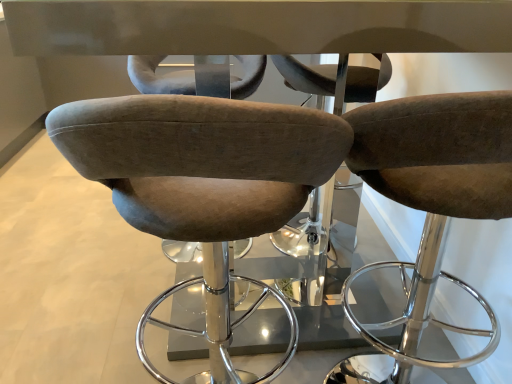
Question: Does point (403, 132) appear closer or farther from the camera than point (292, 175)?

Choices:
 (A) farther
 (B) closer

Answer: (A)

Question: From a real-world perspective, is suede-like brown stool at center, which appears as the 1th chair when viewed from the right, physically located above or below velvet brown stool at center, which is the 2th chair from right to left?

Choices:
 (A) below
 (B) above

Answer: (A)

Question: In terms of width, does suede-like brown stool at center, which appears as the 1th chair when viewed from the right, look wider or thinner when compared to velvet brown stool at center, the 1th chair in the left-to-right sequence?

Choices:
 (A) wide
 (B) thin

Answer: (A)

Question: From the image's perspective, relative to suede-like brown stool at center, which appears as the 1th chair when viewed from the right, is velvet brown stool at center, which is the 2th chair from right to left, above or below?

Choices:
 (A) below
 (B) above

Answer: (A)

Question: Considering the positions of velvet brown stool at center, the 1th chair in the left-to-right sequence, and suede-like brown stool at center, which appears as the 1th chair when viewed from the right, in the image, is velvet brown stool at center, the 1th chair in the left-to-right sequence, bigger or smaller than suede-like brown stool at center, which appears as the 1th chair when viewed from the right,?

Choices:
 (A) big
 (B) small

Answer: (A)

Question: From their relative heights in the image, would you say velvet brown stool at center, the 1th chair in the left-to-right sequence, is taller or shorter than suede-like brown stool at center, positioned as the 2th chair in left-to-right order?

Choices:
 (A) short
 (B) tall

Answer: (A)

Question: Is point (118, 109) closer or farther from the camera than point (457, 182)?

Choices:
 (A) farther
 (B) closer

Answer: (B)